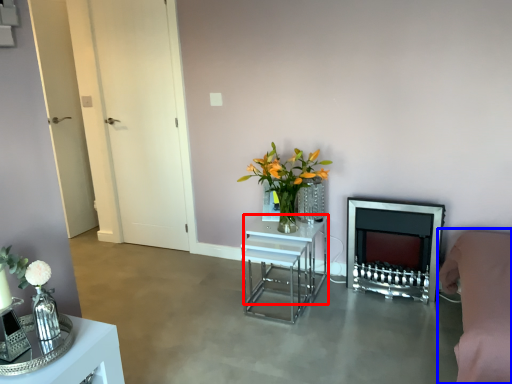
Question: Which of the following is the closest to the observer, table (highlighted by a red box) or couch (highlighted by a blue box)?

Choices:
 (A) table
 (B) couch

Answer: (B)